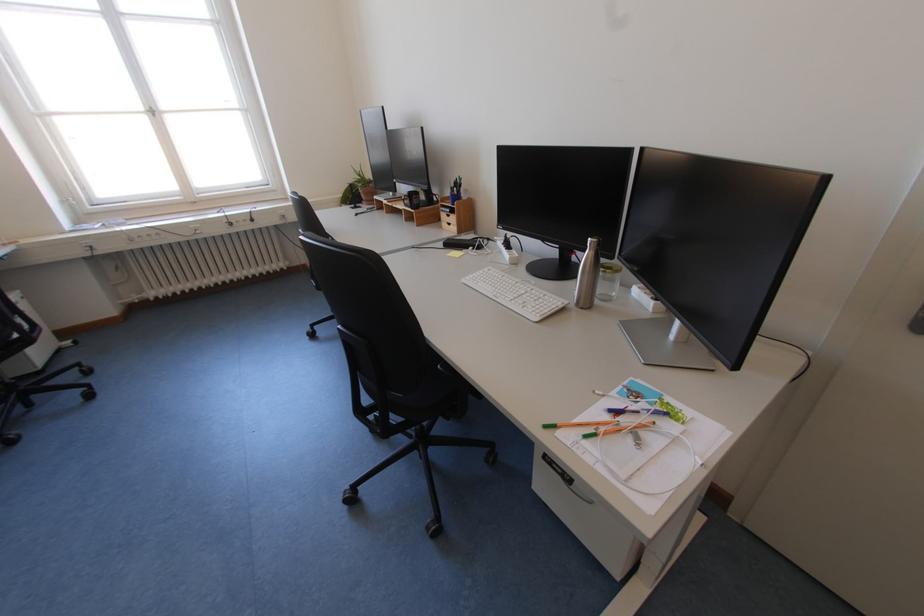
Where is `silver water bottle`? This screenshot has height=616, width=924. silver water bottle is located at coordinates (588, 275).